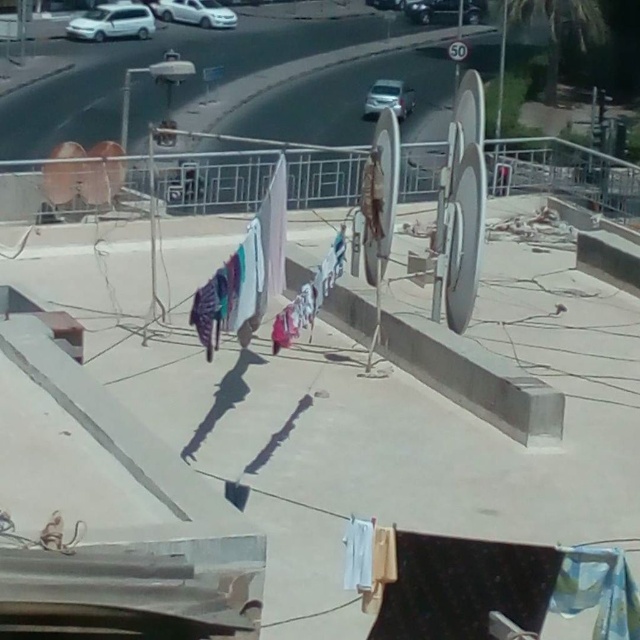
You are a delivery person who needs to park your vehicle on the rooftop. You see the white matte van at upper left and the shiny silver car at upper center. Which vehicle should you park to the right of to ensure proper alignment with the existing vehicles?

A: You should park to the right of the white matte van at upper left because it is already positioned to the left of the shiny silver car at upper center, maintaining the current alignment.